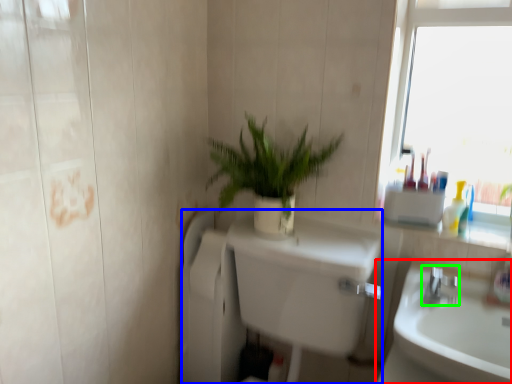
Question: Estimate the real-world distances between objects in this image. Which object is farther from sink (highlighted by a red box), bath (highlighted by a blue box) or tap (highlighted by a green box)?

Choices:
 (A) bath
 (B) tap

Answer: (A)